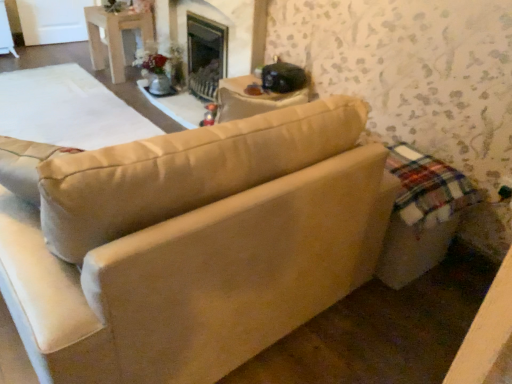
Question: From the image's perspective, is white wood table at upper left located above beige fabric couch at center?

Choices:
 (A) yes
 (B) no

Answer: (A)

Question: Is white wood table at upper left far away from beige fabric couch at center?

Choices:
 (A) no
 (B) yes

Answer: (B)

Question: Is beige fabric couch at center at the back of white wood table at upper left?

Choices:
 (A) yes
 (B) no

Answer: (B)

Question: Considering the relative sizes of white wood table at upper left and beige fabric couch at center in the image provided, is white wood table at upper left smaller than beige fabric couch at center?

Choices:
 (A) no
 (B) yes

Answer: (B)

Question: Does white wood table at upper left have a greater height compared to beige fabric couch at center?

Choices:
 (A) no
 (B) yes

Answer: (A)

Question: Is white wood table at upper left shorter than beige fabric couch at center?

Choices:
 (A) yes
 (B) no

Answer: (A)

Question: Does beige fabric couch at center have a greater width compared to white wood table at upper left?

Choices:
 (A) yes
 (B) no

Answer: (A)

Question: Can we say beige fabric couch at center lies outside white wood table at upper left?

Choices:
 (A) no
 (B) yes

Answer: (B)

Question: Considering the relative sizes of beige fabric couch at center and white wood table at upper left in the image provided, is beige fabric couch at center taller than white wood table at upper left?

Choices:
 (A) yes
 (B) no

Answer: (A)

Question: Is beige fabric couch at center positioned before white wood table at upper left?

Choices:
 (A) yes
 (B) no

Answer: (A)

Question: Does beige fabric couch at center have a lesser width compared to white wood table at upper left?

Choices:
 (A) yes
 (B) no

Answer: (B)

Question: Can you confirm if beige fabric couch at center is bigger than white wood table at upper left?

Choices:
 (A) yes
 (B) no

Answer: (A)

Question: Is white wood table at upper left wider or thinner than beige fabric couch at center?

Choices:
 (A) wide
 (B) thin

Answer: (B)